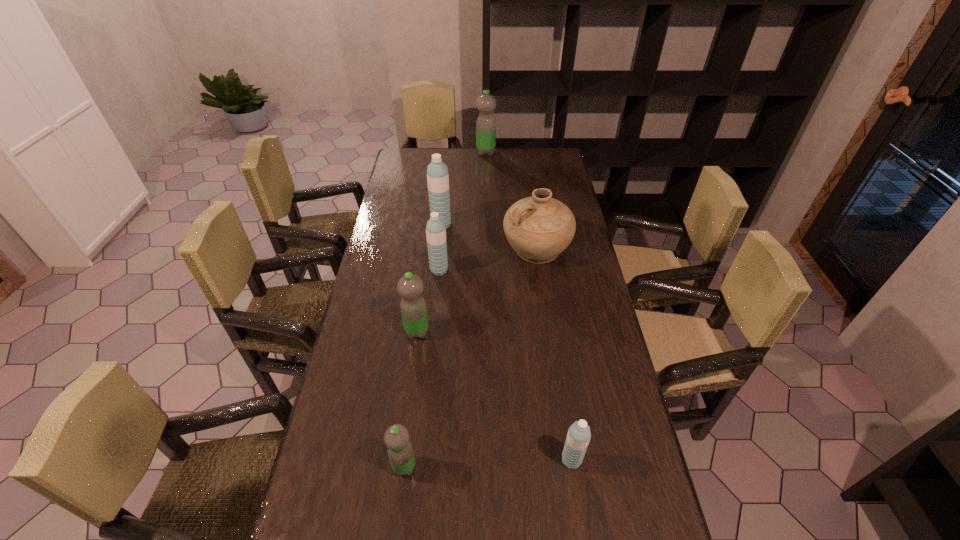
Locate an element on the screen. Image resolution: width=960 pixels, height=540 pixels. the farthest object is located at coordinates 486,103.

You are a GUI agent. You are given a task and a screenshot of the screen. Output one action in this format:
    pyautogui.click(x=<x>, y=<y>)
    Task: Click on the third object from right to left
    The height and width of the screenshot is (540, 960).
    Given the screenshot: What is the action you would take?
    pyautogui.click(x=486, y=103)

Where is `the fifth nearest water bottle`? This screenshot has height=540, width=960. the fifth nearest water bottle is located at coordinates (437, 172).

Find the location of a particular element. This screenshot has width=960, height=540. the biggest blue water bottle is located at coordinates (437, 172).

This screenshot has width=960, height=540. Identify the location of pottery. (539, 228).

Where is `the second smallest green water bottle`? Image resolution: width=960 pixels, height=540 pixels. the second smallest green water bottle is located at coordinates (413, 307).

This screenshot has width=960, height=540. In order to click on the second farthest green water bottle in this screenshot , I will do `click(413, 307)`.

This screenshot has height=540, width=960. I want to click on the second nearest blue water bottle, so click(435, 229).

Find the location of a particular element. the third farthest water bottle is located at coordinates (435, 229).

Find the location of a particular element. The height and width of the screenshot is (540, 960). the rightmost blue water bottle is located at coordinates (578, 437).